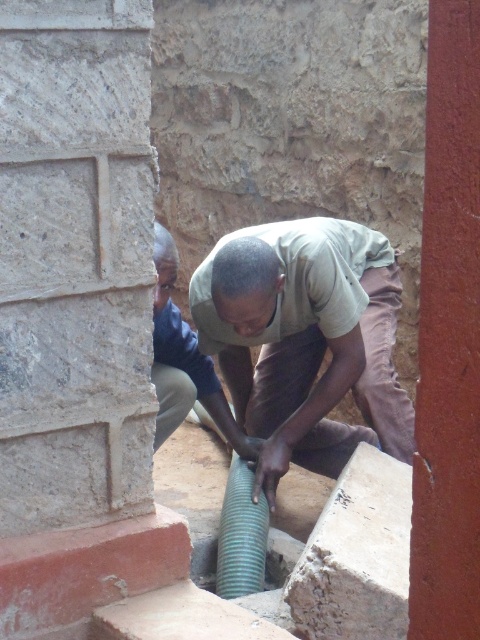
You are standing in the alleyway and want to place a new pipe segment between the two points marked in the image. Which point should you start placing the pipe segment closer to, the one at point (261, 323) or the one at point (216, 566)?

You should start placing the pipe segment closer to point (261, 323) because it is closer to you than point (216, 566).

You are standing at the camera position and want to pick up the matte green corrugated pipe at center. Can you reach it without moving your feet?

The matte green corrugated pipe at center is 3.12 meters away from camera. Since the average human arm length is about 0.7 meters, you cannot reach it without moving your feet.